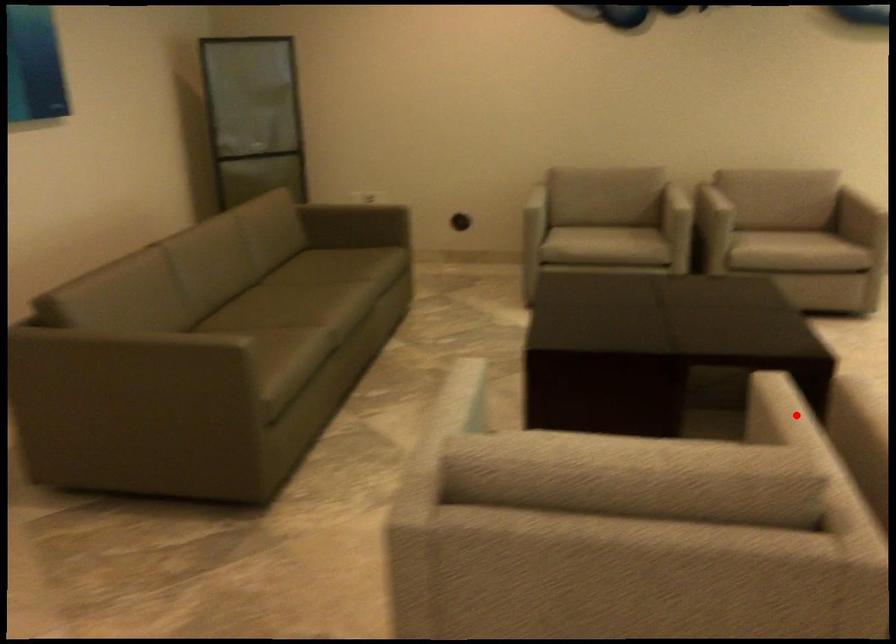
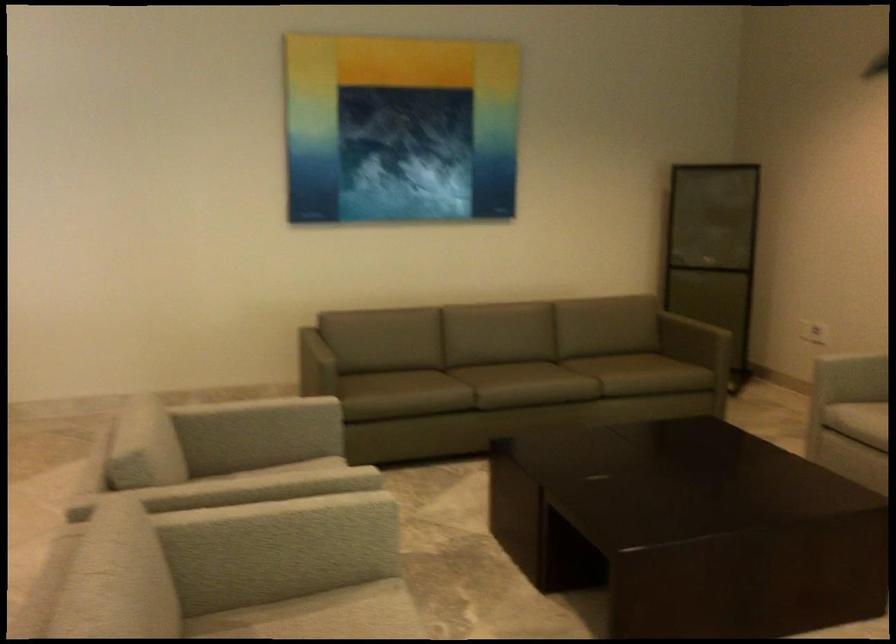
Question: I am providing you with two images of the same scene from different viewpoints. In image1, a red point is highlighted. Considering the same 3D point in image2, which of the following is correct?

Choices:
 (A) It is closer
 (B) It is farther

Answer: (B)